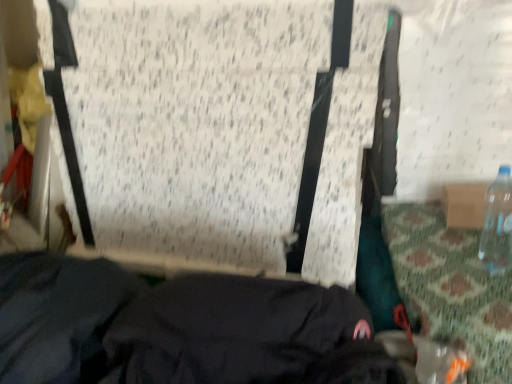
Question: Considering their positions, is clear plastic bottle at right located in front of or behind black fabric at lower center?

Choices:
 (A) front
 (B) behind

Answer: (B)

Question: Considering the positions of clear plastic bottle at right and black fabric at lower center in the image, is clear plastic bottle at right wider or thinner than black fabric at lower center?

Choices:
 (A) thin
 (B) wide

Answer: (A)

Question: Is clear plastic bottle at right situated inside black fabric at lower center or outside?

Choices:
 (A) inside
 (B) outside

Answer: (B)

Question: In terms of height, does black fabric at lower center look taller or shorter compared to clear plastic bottle at right?

Choices:
 (A) short
 (B) tall

Answer: (B)

Question: In the image, is black fabric at lower center positioned in front of or behind clear plastic bottle at right?

Choices:
 (A) front
 (B) behind

Answer: (A)

Question: Would you say black fabric at lower center is to the left or to the right of clear plastic bottle at right in the picture?

Choices:
 (A) right
 (B) left

Answer: (B)

Question: From the image's perspective, is black fabric at lower center positioned above or below clear plastic bottle at right?

Choices:
 (A) below
 (B) above

Answer: (A)